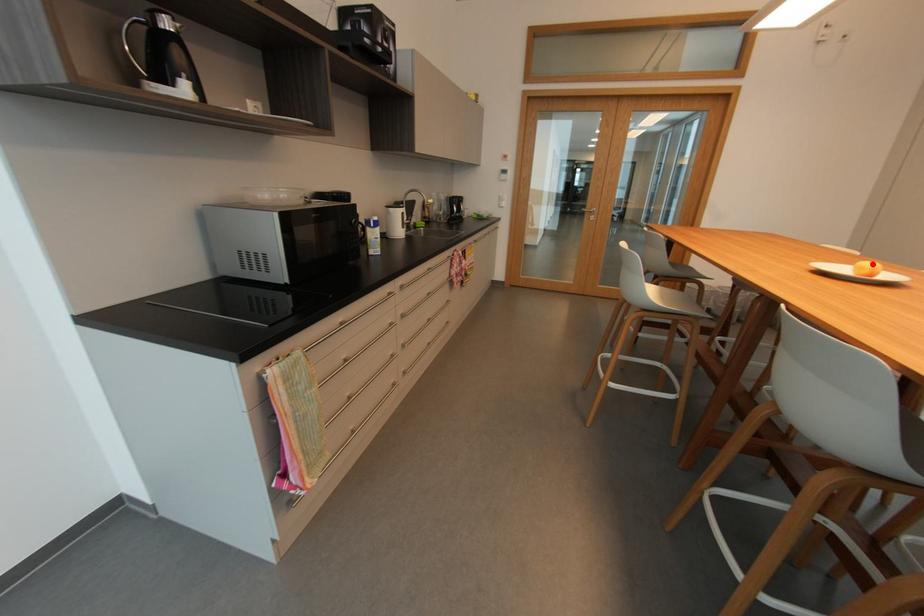
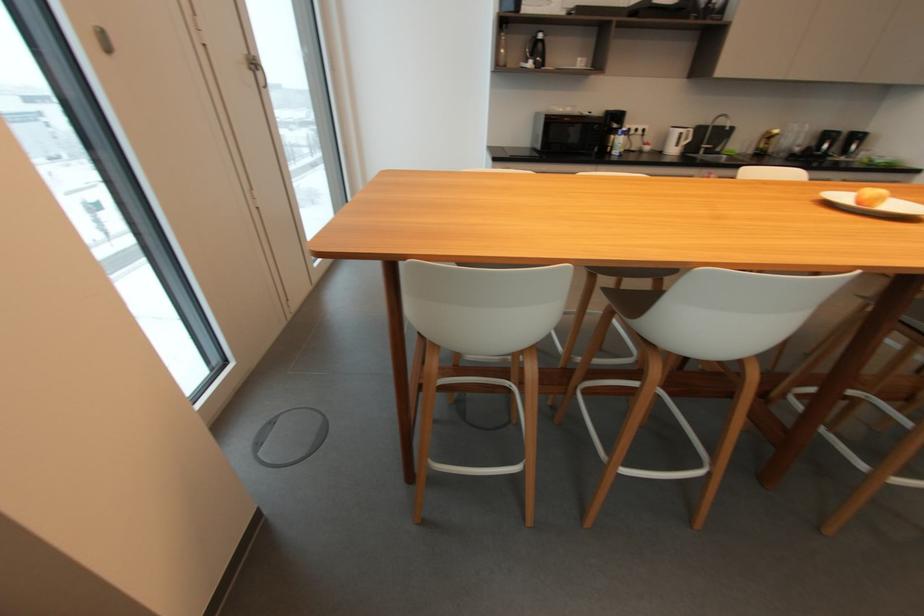
Question: A red point is marked in image1. In image2, is the corresponding 3D point closer to the camera or farther? Reply with the corresponding letter.

Choices:
 (A) The corresponding 3D point is closer.
 (B) The corresponding 3D point is farther.

Answer: (B)